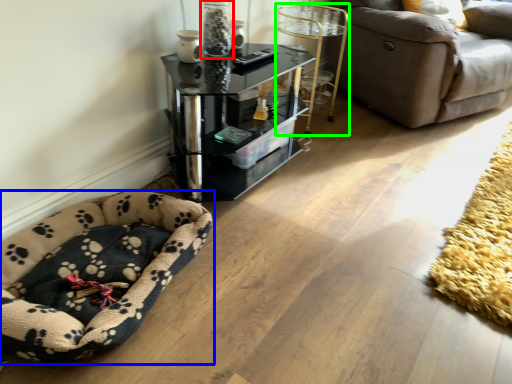
Question: Estimate the real-world distances between objects in this image. Which object is closer to glass vase (highlighted by a red box), dog bed (highlighted by a blue box) or side table (highlighted by a green box)?

Choices:
 (A) dog bed
 (B) side table

Answer: (B)